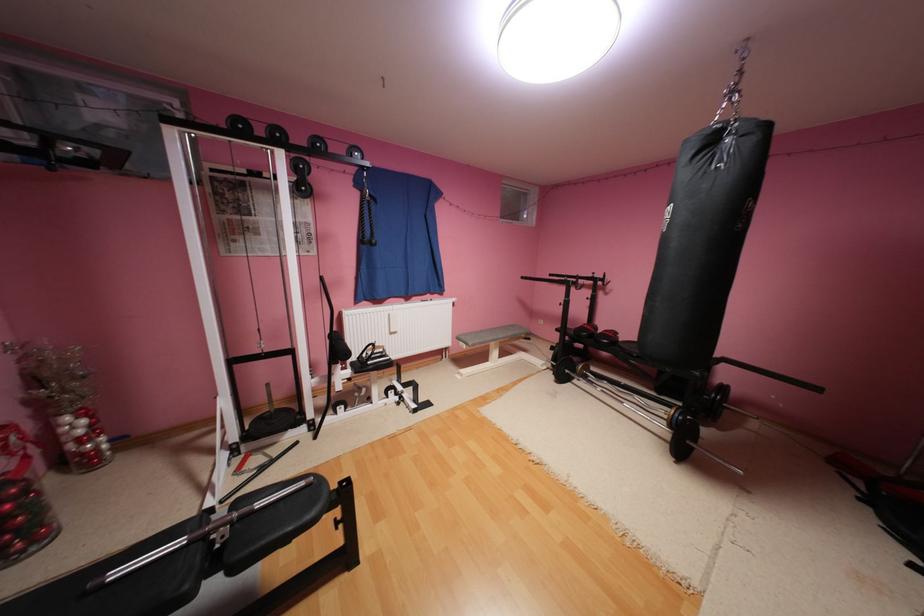
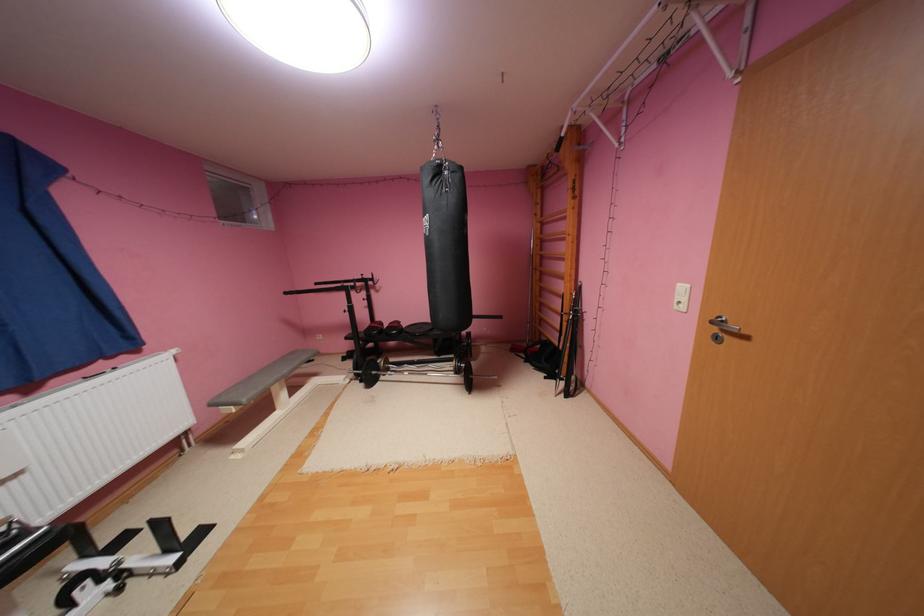
Locate, in the second image, the point that corresponds to point (470, 338) in the first image.

(233, 399)